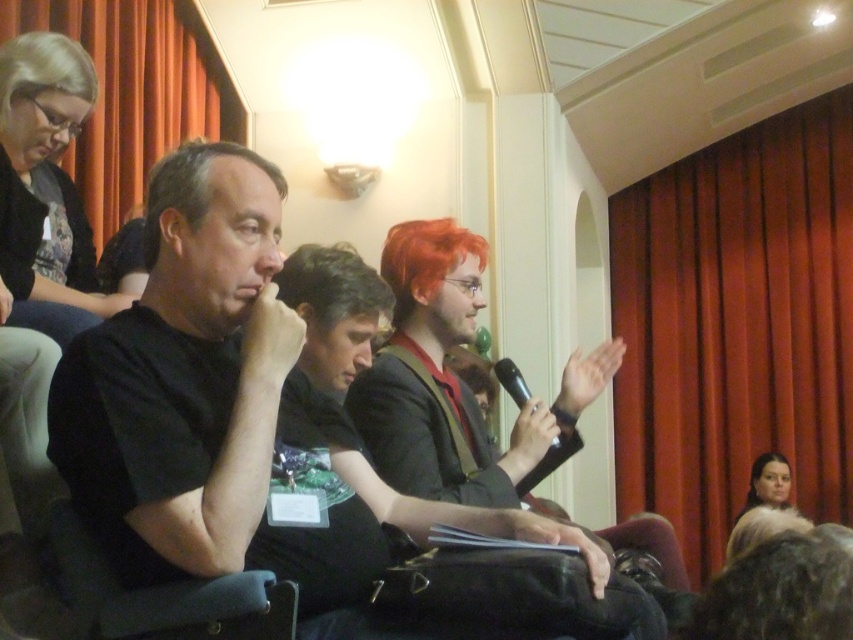
You are organizing a photo shoot and need to ensure that all clothing items in the image are appropriately sized for the models. Given the black matte shirt at left and the fur coat at lower right, which clothing item appears larger in the image?

The black matte shirt at left appears larger than the fur coat at lower right in the image.

You are standing in the conference room and want to locate the red velvet curtain at right. According to the coordinates provided, where should you look to find it?

The red velvet curtain at right is located at coordinates point (735,324).